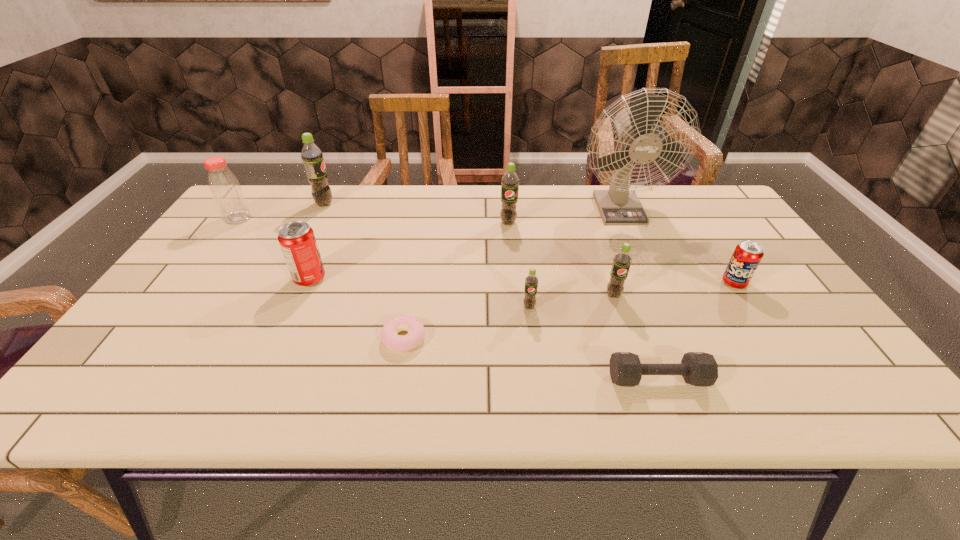
The width and height of the screenshot is (960, 540). Find the location of `the fifth soda from left to right`. the fifth soda from left to right is located at coordinates (622, 260).

Identify the location of the rightmost object. (747, 255).

You are a GUI agent. You are given a task and a screenshot of the screen. Output one action in this format:
    pyautogui.click(x=<x>, y=<y>)
    Task: Click on the right red soda can
    
    Given the screenshot: What is the action you would take?
    point(747,255)

Find the location of a particular element. This screenshot has width=960, height=540. the smallest green soda is located at coordinates (531, 281).

Where is `the nearest green soda`? the nearest green soda is located at coordinates (531, 281).

You are a GUI agent. You are given a task and a screenshot of the screen. Output one action in this format:
    pyautogui.click(x=<x>, y=<y>)
    Task: Click on the nearest object
    The width and height of the screenshot is (960, 540).
    Given the screenshot: What is the action you would take?
    pyautogui.click(x=697, y=368)

At what (x,y) coordinates should I click in order to perform the action: click on gray dumbbell. Please return your answer as a coordinate pair (x, y). The width and height of the screenshot is (960, 540). Looking at the image, I should click on (697, 368).

Locate an element on the screen. This screenshot has width=960, height=540. the ninth farthest object is located at coordinates (416, 332).

Where is `doughnut`? This screenshot has width=960, height=540. doughnut is located at coordinates (416, 332).

Identify the location of vacant space located on the air flow direction of the tallest object. (635, 245).